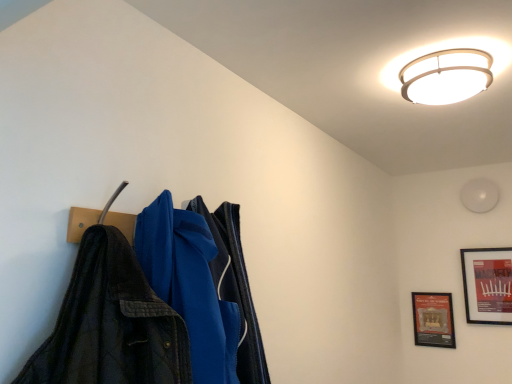
Question: Is white matte light fixture at upper right positioned far away from wooden framed poster at lower right, which appears as the 1th picture frame when viewed from the left?

Choices:
 (A) yes
 (B) no

Answer: (B)

Question: From the image's perspective, is white matte light fixture at upper right on top of wooden framed poster at lower right, which appears as the 1th picture frame when viewed from the left?

Choices:
 (A) no
 (B) yes

Answer: (B)

Question: Is white matte light fixture at upper right oriented towards wooden framed poster at lower right, which appears as the 2th picture frame when viewed from the right?

Choices:
 (A) yes
 (B) no

Answer: (B)

Question: Does white matte light fixture at upper right have a greater width compared to wooden framed poster at lower right, which appears as the 2th picture frame when viewed from the right?

Choices:
 (A) no
 (B) yes

Answer: (B)

Question: Does white matte light fixture at upper right have a smaller size compared to wooden framed poster at lower right, which appears as the 2th picture frame when viewed from the right?

Choices:
 (A) no
 (B) yes

Answer: (A)

Question: Is white matte light fixture at upper right positioned with its back to wooden framed poster at lower right, which appears as the 2th picture frame when viewed from the right?

Choices:
 (A) no
 (B) yes

Answer: (A)

Question: Considering the relative sizes of white matte light fixture at upper right and matte black picture frame at upper right, which is the first picture frame from right to left, in the image provided, is white matte light fixture at upper right thinner than matte black picture frame at upper right, which is the first picture frame from right to left,?

Choices:
 (A) no
 (B) yes

Answer: (A)

Question: Is white matte light fixture at upper right positioned with its back to matte black picture frame at upper right, positioned as the 2th picture frame in left-to-right order?

Choices:
 (A) yes
 (B) no

Answer: (B)

Question: From a real-world perspective, is white matte light fixture at upper right physically below matte black picture frame at upper right, which is the first picture frame from right to left?

Choices:
 (A) yes
 (B) no

Answer: (B)

Question: From the image's perspective, would you say white matte light fixture at upper right is shown under matte black picture frame at upper right, positioned as the 2th picture frame in left-to-right order?

Choices:
 (A) no
 (B) yes

Answer: (A)

Question: Could you tell me if white matte light fixture at upper right is turned towards matte black picture frame at upper right, positioned as the 2th picture frame in left-to-right order?

Choices:
 (A) yes
 (B) no

Answer: (B)

Question: Is white matte light fixture at upper right far from matte black picture frame at upper right, positioned as the 2th picture frame in left-to-right order?

Choices:
 (A) no
 (B) yes

Answer: (A)

Question: Is white glossy ceiling light at upper center positioned behind matte black picture frame at upper right, positioned as the 2th picture frame in left-to-right order?

Choices:
 (A) no
 (B) yes

Answer: (A)